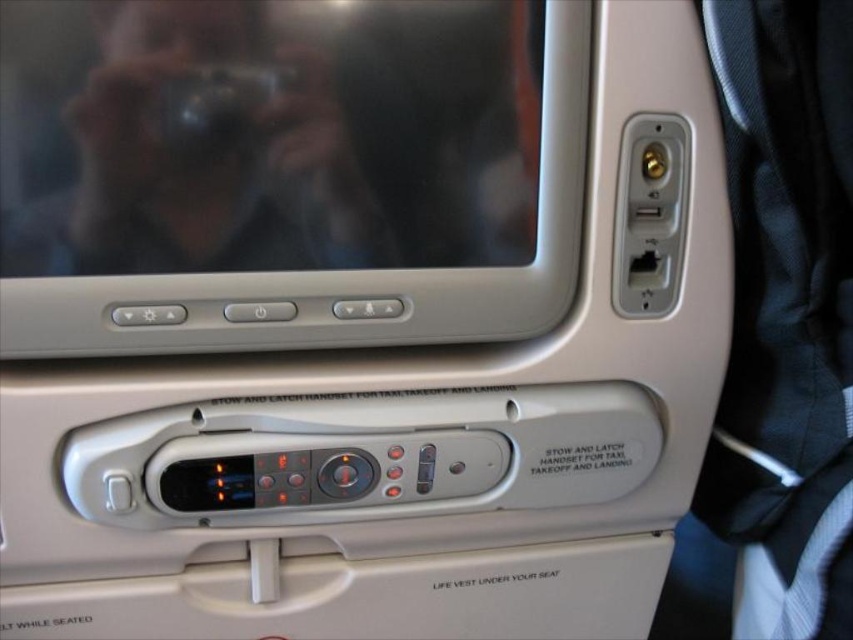
You are a flight attendant checking the in flight entertainment system. You need to ensure that the metallic black camera at upper center is not blocking the satin silver screen at upper center. Is this the case?

The metallic black camera at upper center is behind the satin silver screen at upper center, so it is not blocking the screen.

You are a passenger trying to locate two points on the airplane seat entertainment system. The first point is at coordinates point (294, 323) and the second is at point (192, 125). Which point is closer to you?

Point (192, 125) is closer to you because it is closer to the camera than point (294, 323).